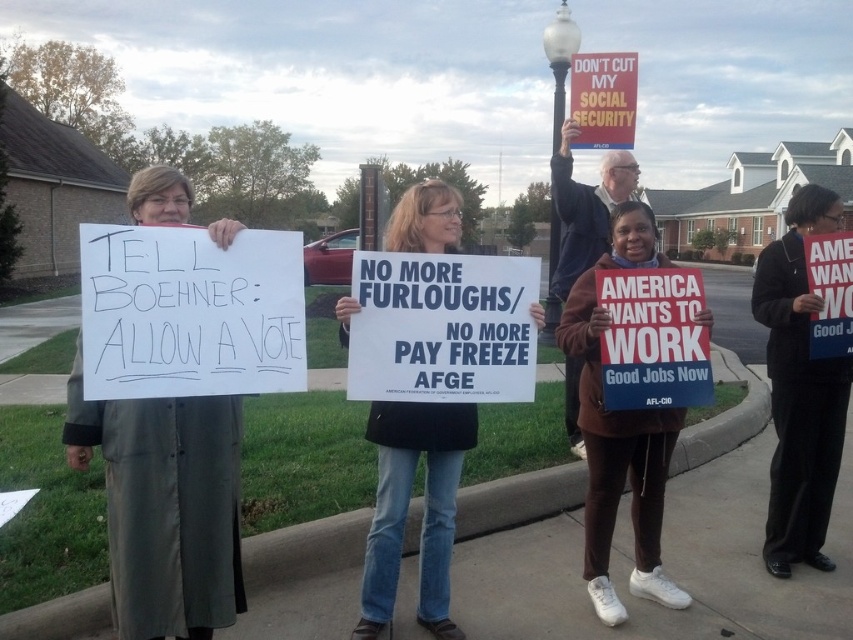
Question: Which of the following is the closest to the observer?

Choices:
 (A) (827, 465)
 (B) (381, 408)
 (C) (599, 56)
 (D) (550, 292)

Answer: (B)

Question: Which point is farther to the camera?

Choices:
 (A) (614, 106)
 (B) (799, 492)

Answer: (A)

Question: Is matte red sign at upper center above white glass lamp post at upper center?

Choices:
 (A) yes
 (B) no

Answer: (B)

Question: Does brown suede jacket at center have a smaller size compared to matte red sign at upper center?

Choices:
 (A) no
 (B) yes

Answer: (B)

Question: Can you confirm if black fabric jacket at upper right is positioned to the right of white glass lamp post at upper center?

Choices:
 (A) no
 (B) yes

Answer: (B)

Question: Which point appears closest to the camera in this image?

Choices:
 (A) (68, 420)
 (B) (608, 509)
 (C) (757, 291)

Answer: (A)